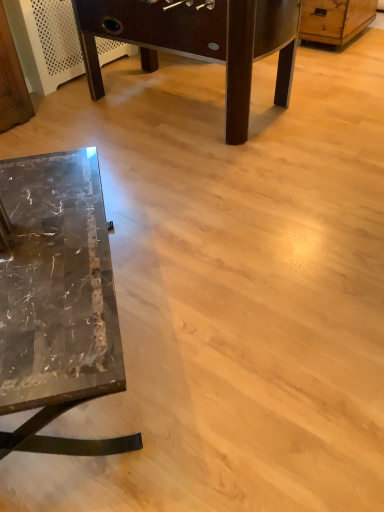
Describe the element at coordinates (198, 41) in the screenshot. The image size is (384, 512). I see `marble table at lower left, which ranks as the second table in front-to-back order` at that location.

You are a GUI agent. You are given a task and a screenshot of the screen. Output one action in this format:
    pyautogui.click(x=<x>, y=<y>)
    Task: Click on the marble table at lower left, the first table when ordered from bottom to top
    Image resolution: width=384 pixels, height=512 pixels.
    Given the screenshot: What is the action you would take?
    pyautogui.click(x=56, y=300)

Looking at this image, is marble table at lower left, the 1th table from the back, not inside marble table at lower left, which is the second table in back-to-front order?

marble table at lower left, the 1th table from the back, lies outside marble table at lower left, which is the second table in back-to-front order,'s area.

Considering the positions of points (160, 38) and (65, 223), is point (160, 38) closer to camera compared to point (65, 223)?

No.

Can you tell me how much marble table at lower left, the 1th table from the back, and marble table at lower left, which is the second table in back-to-front order, differ in facing direction?

marble table at lower left, the 1th table from the back, and marble table at lower left, which is the second table in back-to-front order, are facing 41.1 degrees away from each other.

Is marble table at lower left, which is the 2th table in bottom-to-top order, facing away from marble table at lower left, which is the second table in back-to-front order?

That's right, marble table at lower left, which is the 2th table in bottom-to-top order, is facing away from marble table at lower left, which is the second table in back-to-front order.

From the image's perspective, is wooden dresser at upper right above or below marble table at lower left, the first table when ordered from bottom to top?

From the image's perspective, wooden dresser at upper right appears above marble table at lower left, the first table when ordered from bottom to top.

Considering the points (346, 31) and (131, 441), which point is in front, point (346, 31) or point (131, 441)?

The point (131, 441) is closer to the camera.

Considering the relative sizes of wooden dresser at upper right and marble table at lower left, the first table when ordered from bottom to top, in the image provided, is wooden dresser at upper right smaller than marble table at lower left, the first table when ordered from bottom to top,?

Indeed, wooden dresser at upper right has a smaller size compared to marble table at lower left, the first table when ordered from bottom to top.

In terms of size, does marble table at lower left, which is the 1th table in top-to-bottom order, appear bigger or smaller than wooden dresser at upper right?

marble table at lower left, which is the 1th table in top-to-bottom order, is bigger than wooden dresser at upper right.

From a real-world perspective, relative to wooden dresser at upper right, is marble table at lower left, which is the 2th table in bottom-to-top order, vertically above or below?

marble table at lower left, which is the 2th table in bottom-to-top order, is above wooden dresser at upper right.

Is wooden dresser at upper right completely or partially inside marble table at lower left, which is the 2th table in bottom-to-top order?

Definitely not — wooden dresser at upper right is not inside marble table at lower left, which is the 2th table in bottom-to-top order.

Could you tell me if marble table at lower left, the 1th table from the back, is facing wooden dresser at upper right?

Yes, marble table at lower left, the 1th table from the back, is oriented towards wooden dresser at upper right.

Is marble table at lower left, which is the 2th table in top-to-bottom order, positioned with its back to marble table at lower left, which is the 2th table in bottom-to-top order?

That's not correct — marble table at lower left, which is the 2th table in top-to-bottom order, is not looking away from marble table at lower left, which is the 2th table in bottom-to-top order.

Can you confirm if marble table at lower left, which appears as the 1th table when viewed from the front, is shorter than marble table at lower left, the 1th table from the back?

Indeed, marble table at lower left, which appears as the 1th table when viewed from the front, has a lesser height compared to marble table at lower left, the 1th table from the back.

In the scene shown: Which of these two, marble table at lower left, the first table when ordered from bottom to top, or marble table at lower left, which ranks as the second table in front-to-back order, is smaller?

marble table at lower left, the first table when ordered from bottom to top.

Which is more to the right, marble table at lower left, which appears as the 1th table when viewed from the front, or wooden dresser at upper right?

From the viewer's perspective, wooden dresser at upper right appears more on the right side.

Can you confirm if marble table at lower left, which is the second table in back-to-front order, is thinner than wooden dresser at upper right?

No.

Considering the positions of objects marble table at lower left, which appears as the 1th table when viewed from the front, and wooden dresser at upper right in the image provided, who is behind, marble table at lower left, which appears as the 1th table when viewed from the front, or wooden dresser at upper right?

wooden dresser at upper right is more distant.

Choose the correct answer: Is marble table at lower left, which is the second table in back-to-front order, inside wooden dresser at upper right or outside it?

marble table at lower left, which is the second table in back-to-front order, lies outside wooden dresser at upper right.

Is marble table at lower left, which ranks as the second table in front-to-back order, a part of wooden dresser at upper right?

That's incorrect, marble table at lower left, which ranks as the second table in front-to-back order, is not inside wooden dresser at upper right.

Is wooden dresser at upper right taller or shorter than marble table at lower left, which is the 1th table in top-to-bottom order?

Clearly, wooden dresser at upper right is shorter compared to marble table at lower left, which is the 1th table in top-to-bottom order.

Is wooden dresser at upper right next to marble table at lower left, which ranks as the second table in front-to-back order, and touching it?

wooden dresser at upper right and marble table at lower left, which ranks as the second table in front-to-back order, are not in contact.

Which is closer to the camera, (318, 13) or (90, 4)?

Point (318, 13) is farther from the camera than point (90, 4).

At what (x,y) coordinates should I click in order to perform the action: click on table that is above the marble table at lower left, which is the second table in back-to-front order (from the image's perspective). Please return your answer as a coordinate pair (x, y). Looking at the image, I should click on (198, 41).

This screenshot has width=384, height=512. I want to click on dresser above the marble table at lower left, which is the 2th table in top-to-bottom order (from a real-world perspective), so click(335, 20).

Estimate the real-world distances between objects in this image. Which object is further from marble table at lower left, which ranks as the second table in front-to-back order, wooden dresser at upper right or marble table at lower left, the first table when ordered from bottom to top?

Based on the image, wooden dresser at upper right appears to be further to marble table at lower left, which ranks as the second table in front-to-back order.

Looking at the image, which one is located closer to wooden dresser at upper right, marble table at lower left, which ranks as the second table in front-to-back order, or marble table at lower left, which is the second table in back-to-front order?

marble table at lower left, which ranks as the second table in front-to-back order, lies closer to wooden dresser at upper right than the other object.

Consider the image. Looking at the image, which one is located further to wooden dresser at upper right, marble table at lower left, which appears as the 1th table when viewed from the front, or marble table at lower left, which is the 2th table in bottom-to-top order?

marble table at lower left, which appears as the 1th table when viewed from the front, is further to wooden dresser at upper right.

Considering their positions, is marble table at lower left, which ranks as the second table in front-to-back order, positioned closer to marble table at lower left, which appears as the 1th table when viewed from the front, than wooden dresser at upper right?

Based on the image, marble table at lower left, which ranks as the second table in front-to-back order, appears to be nearer to marble table at lower left, which appears as the 1th table when viewed from the front.

Which object lies nearer to the anchor point marble table at lower left, the 1th table from the back, marble table at lower left, the first table when ordered from bottom to top, or wooden dresser at upper right?

Among the two, marble table at lower left, the first table when ordered from bottom to top, is located nearer to marble table at lower left, the 1th table from the back.

From the picture: Looking at the image, which one is located closer to marble table at lower left, which appears as the 1th table when viewed from the front, wooden dresser at upper right or marble table at lower left, which is the 1th table in top-to-bottom order?

marble table at lower left, which is the 1th table in top-to-bottom order, lies closer to marble table at lower left, which appears as the 1th table when viewed from the front, than the other object.

You are a GUI agent. You are given a task and a screenshot of the screen. Output one action in this format:
    pyautogui.click(x=<x>, y=<y>)
    Task: Click on the table between marble table at lower left, which is the second table in back-to-front order, and wooden dresser at upper right, along the z-axis
    This screenshot has height=512, width=384.
    Given the screenshot: What is the action you would take?
    pyautogui.click(x=198, y=41)